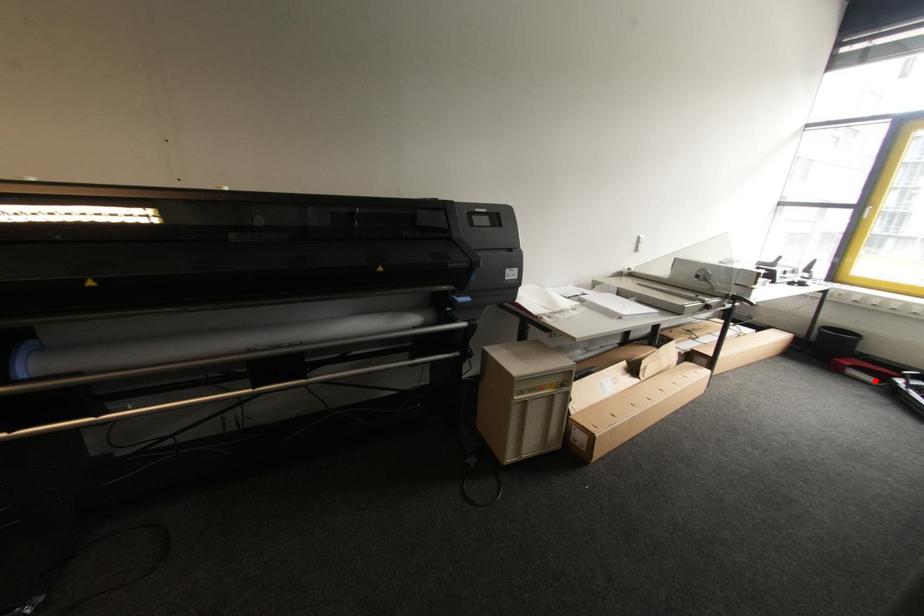
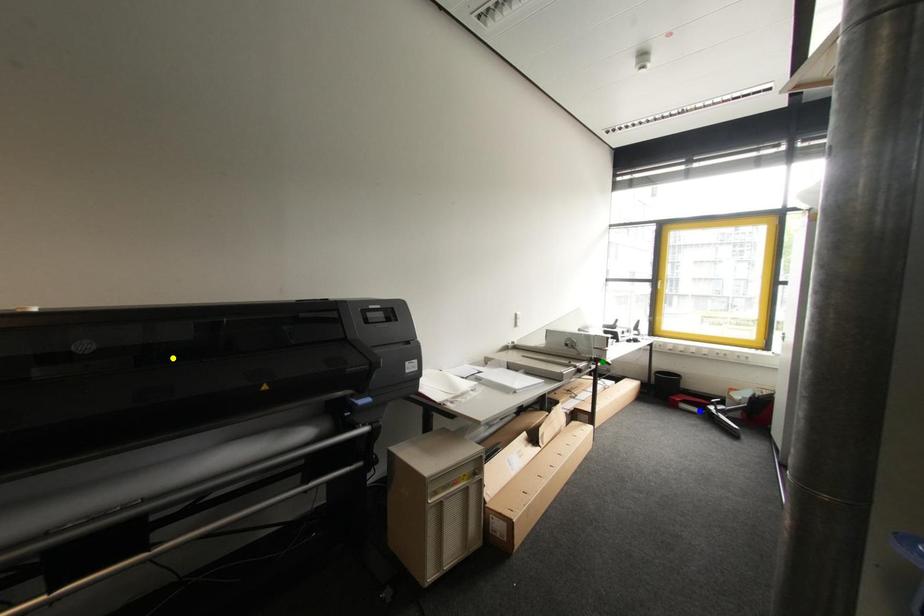
Question: I am providing you with two images of the same scene from different viewpoints. A red point is marked on the first image. You are given multiple points on the second image. Which point in image 2 is actually the same real-world point as the red point in image 1?

Choices:
 (A) green point
 (B) yellow point
 (C) blue point

Answer: (C)